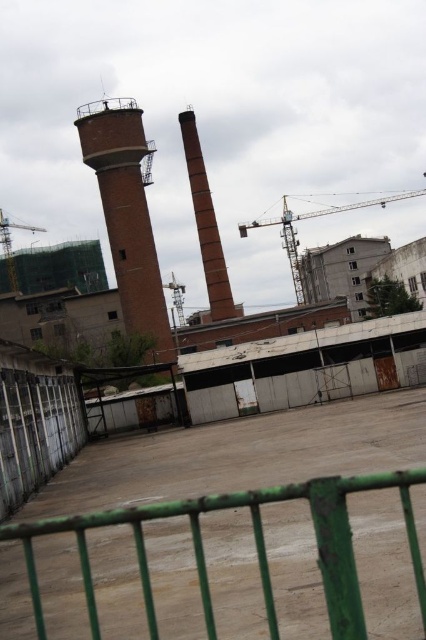
Is point (203, 182) less distant than point (11, 262)?

Yes.

Does brick chimney at center appear over metallic gray crane at left?

Actually, brick chimney at center is below metallic gray crane at left.

Is point (201, 186) farther from viewer compared to point (2, 234)?

No, it is not.

Find the location of a particular element. The height and width of the screenshot is (640, 426). brick chimney at center is located at coordinates (206, 221).

Can you confirm if brick tower at center is positioned above metallic gray crane at left?

No.

Does point (143, 260) come farther from viewer compared to point (45, 228)?

That is False.

Find the location of `brick tower at center`. brick tower at center is located at coordinates point(126,216).

Between brick tower at center and brick chimney at center, which one is positioned lower?

brick tower at center

Does brick tower at center appear on the right side of brick chimney at center?

Incorrect, brick tower at center is not on the right side of brick chimney at center.

At what (x,y) coordinates should I click in order to perform the action: click on brick tower at center. Please return your answer as a coordinate pair (x, y). The height and width of the screenshot is (640, 426). Looking at the image, I should click on (126, 216).